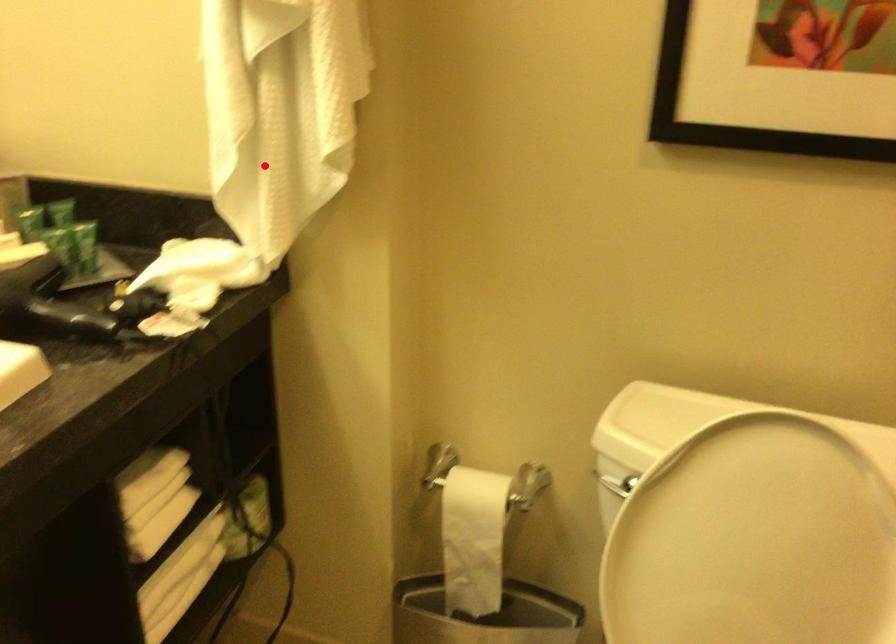
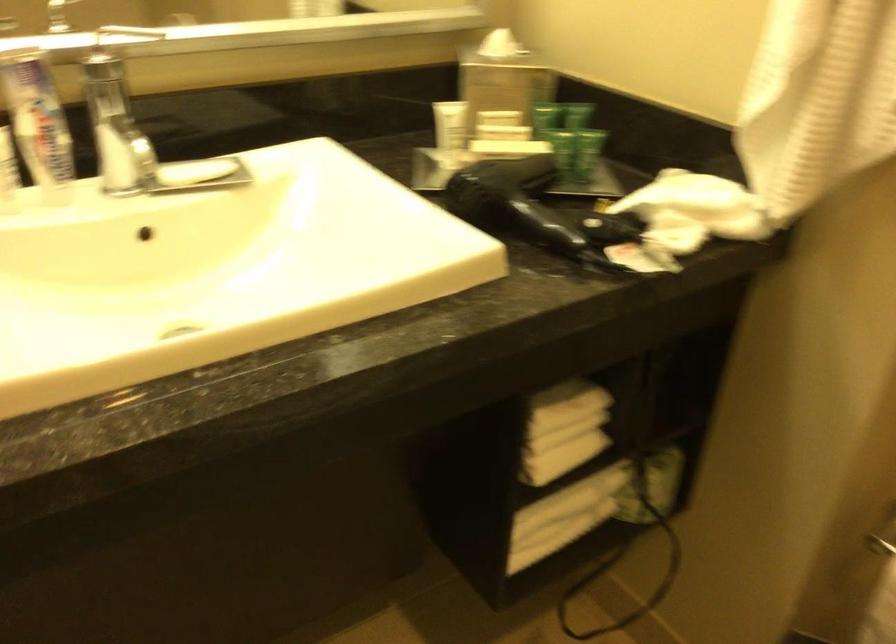
Question: I am providing you with two images of the same scene from different viewpoints. Given a red point in image1, look at the same physical point in image2. Is it:

Choices:
 (A) Closer to the viewpoint
 (B) Farther from the viewpoint

Answer: (A)